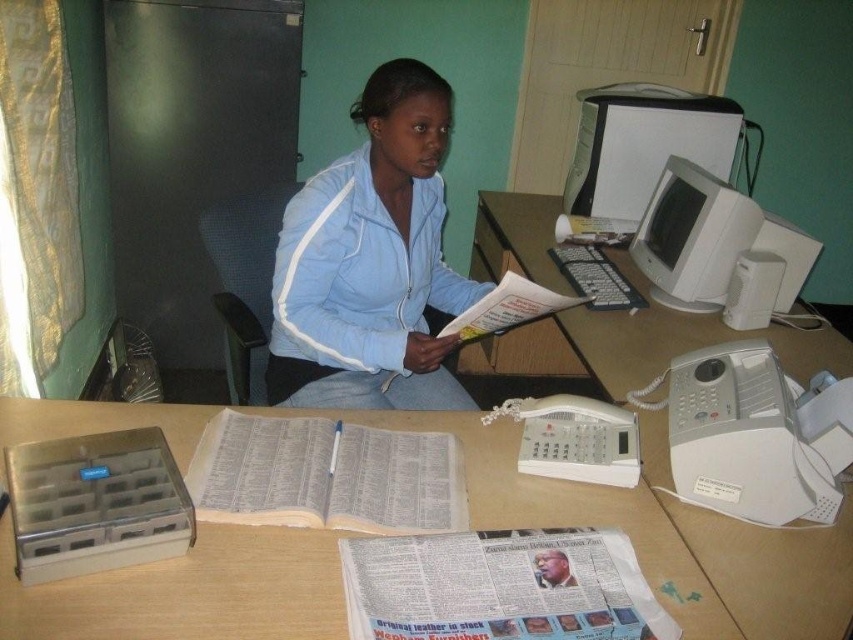
You are standing in the office and want to reach both the point at coordinates (293,596) and the point at (456,323). Which point should you approach first to minimize the distance walked?

You should approach point (293,596) first because it is closer to you than point (456,323), so reaching it first would require less walking distance.

You are organizing a small event and need to place a 10cm tall figurine on the wooden table at center or the white paper at center. Which surface can safely hold the figurine without it toppling over due to height differences?

The wooden table at center is much taller than the white paper at center, so placing the figurine on the wooden table at center would be safer to prevent it from toppling over due to its height advantage.